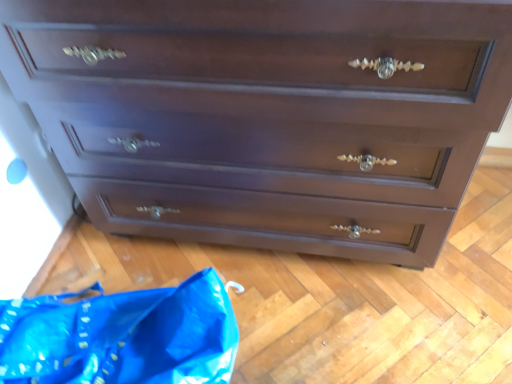
Locate an element on the screen. This screenshot has width=512, height=384. vacant space to the right of blue plastic bag at lower left is located at coordinates (305, 311).